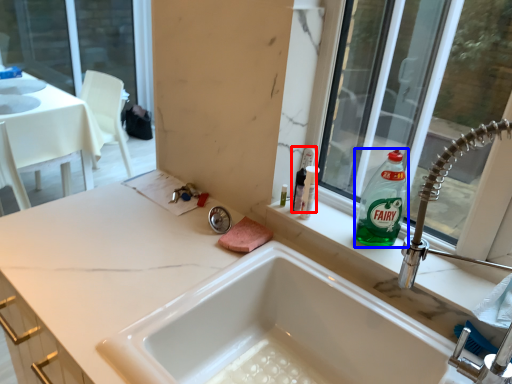
Question: Which point is further to the camera, toiletry (highlighted by a red box) or cleaning product (highlighted by a blue box)?

Choices:
 (A) toiletry
 (B) cleaning product

Answer: (A)